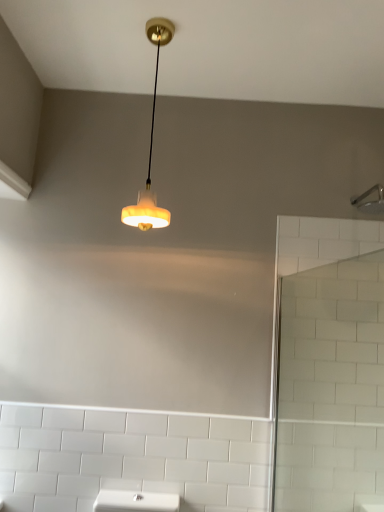
Question: From a real-world perspective, is matte white lampshade at upper center physically located above or below white glass screen door at right?

Choices:
 (A) below
 (B) above

Answer: (B)

Question: Considering the positions of matte white lampshade at upper center and white glass screen door at right in the image, is matte white lampshade at upper center taller or shorter than white glass screen door at right?

Choices:
 (A) tall
 (B) short

Answer: (B)

Question: Estimate the real-world distances between objects in this image. Which object is farther from the white glass screen door at right?

Choices:
 (A) matte white lampshade at upper center
 (B) silver metallic shower head at upper right

Answer: (A)

Question: Estimate the real-world distances between objects in this image. Which object is closer to the white glass screen door at right?

Choices:
 (A) silver metallic shower head at upper right
 (B) matte white lampshade at upper center

Answer: (A)